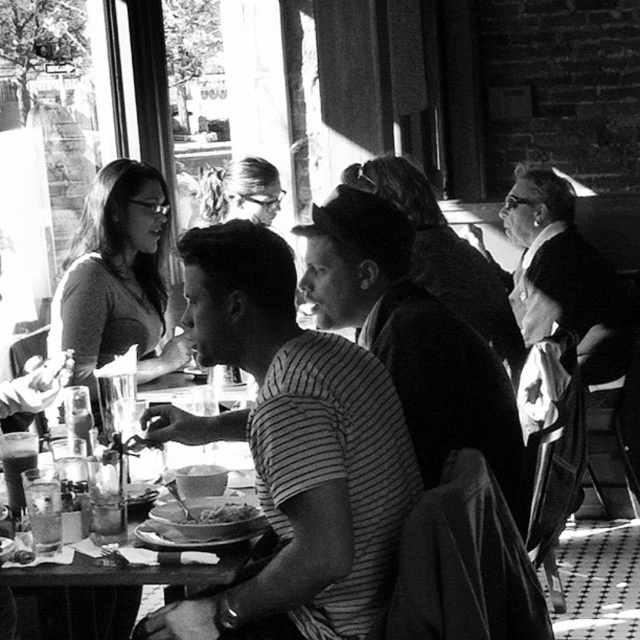
Question: Among these objects, which one is nearest to the camera?

Choices:
 (A) striped fabric shirt at center
 (B) matte gray shirt at center

Answer: (A)

Question: Can you confirm if striped fabric shirt at center is thinner than wooden table at center?

Choices:
 (A) yes
 (B) no

Answer: (B)

Question: Which object appears closest to the camera in this image?

Choices:
 (A) smooth brown bread at center
 (B) wooden table at center

Answer: (B)

Question: Is striped fabric shirt at center to the left of smooth brown bread at center from the viewer's perspective?

Choices:
 (A) yes
 (B) no

Answer: (B)

Question: Among these objects, which one is farthest from the camera?

Choices:
 (A) wooden table at center
 (B) matte gray shirt at center
 (C) striped fabric shirt at center

Answer: (B)

Question: Does matte gray shirt at center appear over smooth brown bread at center?

Choices:
 (A) no
 (B) yes

Answer: (B)